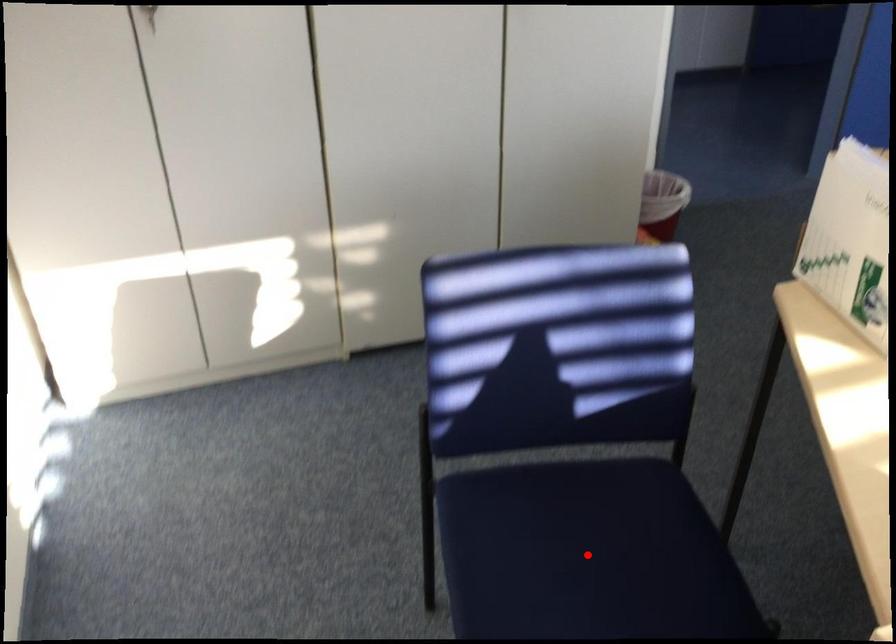
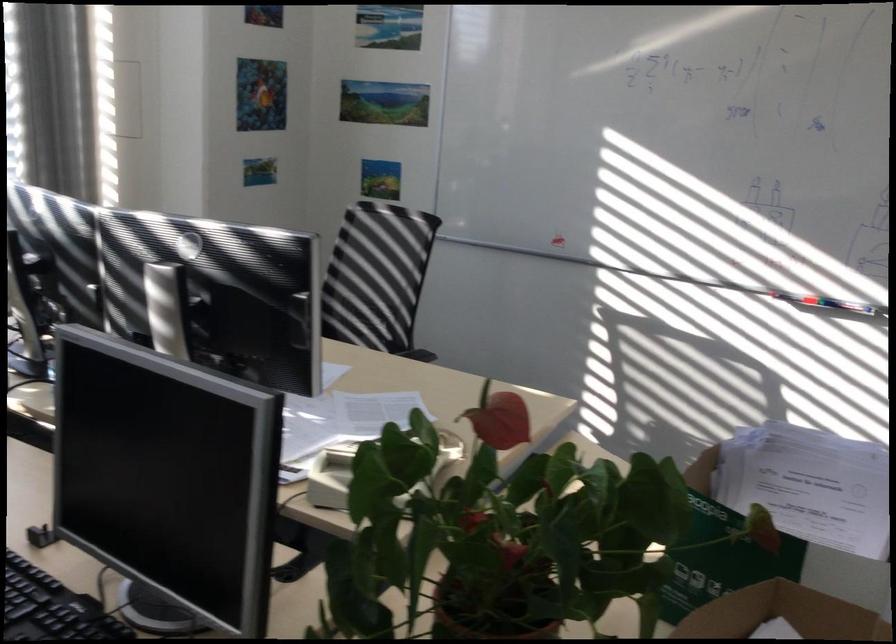
Question: I am providing you with two images of the same scene from different viewpoints. A red point is marked on the first image. Is the red point's position out of view in image 2?

Choices:
 (A) Yes
 (B) No

Answer: (A)